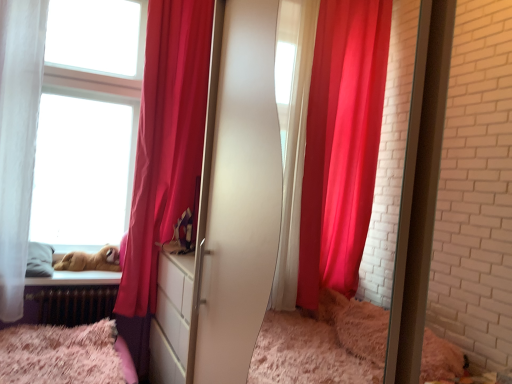
Question: Is silky red curtain at left in front of or behind fluffy pink bed at lower left in the image?

Choices:
 (A) front
 (B) behind

Answer: (B)

Question: Considering the positions of silky red curtain at left and fluffy pink bed at lower left in the image, is silky red curtain at left taller or shorter than fluffy pink bed at lower left?

Choices:
 (A) tall
 (B) short

Answer: (A)

Question: Which object is the farthest from the brown plush toy at lower left?

Choices:
 (A) fluffy pink bed at lower left
 (B) silky red curtain at left

Answer: (B)

Question: Which of these objects is positioned closest to the fluffy pink bed at lower left?

Choices:
 (A) brown plush toy at lower left
 (B) silky red curtain at left

Answer: (A)